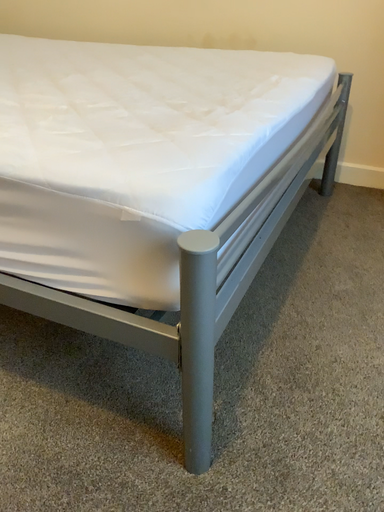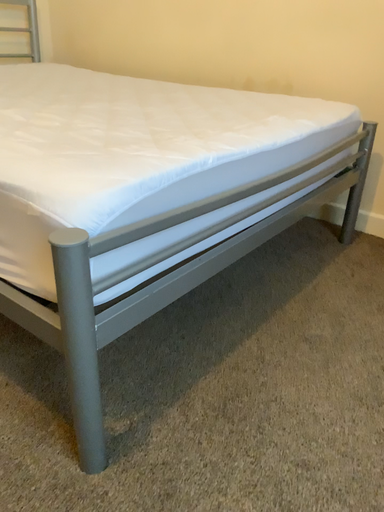
Question: How did the camera likely rotate when shooting the video?

Choices:
 (A) rotated right
 (B) rotated left

Answer: (B)